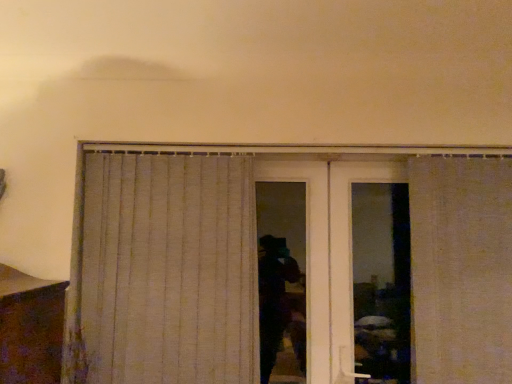
Question: Does white textured curtain at right, which is the 1th curtain in right-to-left order, have a lesser height compared to beige fabric curtain at center, which is the 2th curtain in right-to-left order?

Choices:
 (A) no
 (B) yes

Answer: (B)

Question: Is the position of white textured curtain at right, which ranks as the 2th curtain in left-to-right order, more distant than that of beige fabric curtain at center, which is the 2th curtain in right-to-left order?

Choices:
 (A) yes
 (B) no

Answer: (B)

Question: Would you consider white textured curtain at right, which is the 1th curtain in right-to-left order, to be distant from beige fabric curtain at center, the 1th curtain positioned from the left?

Choices:
 (A) no
 (B) yes

Answer: (B)

Question: Does white textured curtain at right, which ranks as the 2th curtain in left-to-right order, have a lesser width compared to beige fabric curtain at center, which is the 2th curtain in right-to-left order?

Choices:
 (A) yes
 (B) no

Answer: (B)

Question: Is white textured curtain at right, which ranks as the 2th curtain in left-to-right order, turned away from beige fabric curtain at center, which is the 2th curtain in right-to-left order?

Choices:
 (A) no
 (B) yes

Answer: (A)

Question: Does white textured curtain at right, which ranks as the 2th curtain in left-to-right order, have a greater height compared to beige fabric curtain at center, the 1th curtain positioned from the left?

Choices:
 (A) yes
 (B) no

Answer: (B)

Question: Is beige fabric curtain at center, which is the 2th curtain in right-to-left order, placed right next to white textured curtain at right, which is the 1th curtain in right-to-left order?

Choices:
 (A) no
 (B) yes

Answer: (A)

Question: From a real-world perspective, is beige fabric curtain at center, the 1th curtain positioned from the left, physically above white textured curtain at right, which is the 1th curtain in right-to-left order?

Choices:
 (A) no
 (B) yes

Answer: (A)

Question: Is beige fabric curtain at center, which is the 2th curtain in right-to-left order, facing towards white textured curtain at right, which is the 1th curtain in right-to-left order?

Choices:
 (A) no
 (B) yes

Answer: (A)

Question: Is beige fabric curtain at center, the 1th curtain positioned from the left, behind white textured curtain at right, which ranks as the 2th curtain in left-to-right order?

Choices:
 (A) no
 (B) yes

Answer: (B)

Question: Are beige fabric curtain at center, the 1th curtain positioned from the left, and white textured curtain at right, which is the 1th curtain in right-to-left order, far apart?

Choices:
 (A) no
 (B) yes

Answer: (B)

Question: From the image's perspective, is beige fabric curtain at center, the 1th curtain positioned from the left, on white textured curtain at right, which ranks as the 2th curtain in left-to-right order?

Choices:
 (A) no
 (B) yes

Answer: (B)

Question: From the image's perspective, relative to white textured curtain at right, which is the 1th curtain in right-to-left order, is beige fabric curtain at center, which is the 2th curtain in right-to-left order, above or below?

Choices:
 (A) below
 (B) above

Answer: (B)